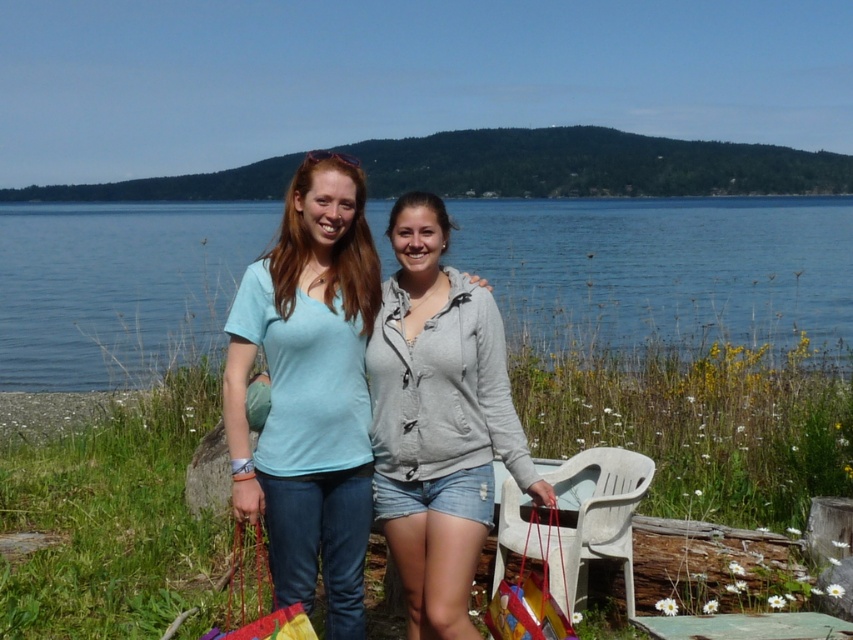
Question: Does blue water at center have a smaller size compared to light blue cotton t-shirt at center?

Choices:
 (A) no
 (B) yes

Answer: (A)

Question: Does blue water at center come in front of green grass at lower center?

Choices:
 (A) no
 (B) yes

Answer: (B)

Question: Which object appears closest to the camera in this image?

Choices:
 (A) blue water at center
 (B) light blue cotton t-shirt at center
 (C) green grass at lower center

Answer: (B)

Question: Which object is closer to the camera taking this photo?

Choices:
 (A) light blue cotton t-shirt at center
 (B) blue water at center
 (C) gray matte hoodie at center

Answer: (C)

Question: Is blue water at center to the left of gray matte hoodie at center from the viewer's perspective?

Choices:
 (A) yes
 (B) no

Answer: (B)

Question: Which of the following is the closest to the observer?

Choices:
 (A) (320, 413)
 (B) (640, 428)

Answer: (A)